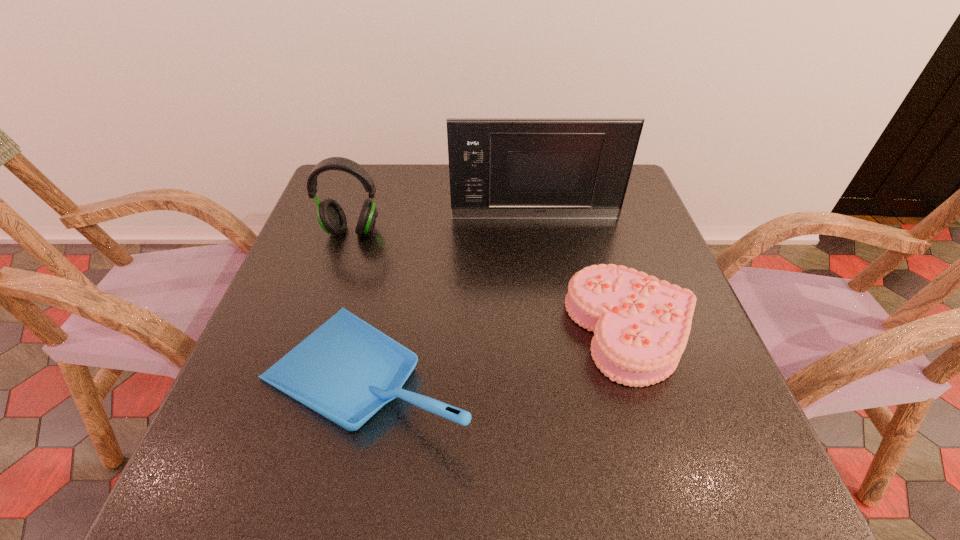
Locate an element on the screen. This screenshot has height=540, width=960. vacant region at the near left corner of the desktop is located at coordinates (228, 454).

Where is `vacant region at the far right corner of the desktop`? vacant region at the far right corner of the desktop is located at coordinates (637, 194).

In the image, there is a desktop. Where is `vacant space at the near right corner`? The width and height of the screenshot is (960, 540). vacant space at the near right corner is located at coordinates (746, 485).

At what (x,y) coordinates should I click in order to perform the action: click on vacant area that lies between the third shortest object and the microwave oven. Please return your answer as a coordinate pair (x, y). Image resolution: width=960 pixels, height=540 pixels. Looking at the image, I should click on (444, 225).

You are a GUI agent. You are given a task and a screenshot of the screen. Output one action in this format:
    pyautogui.click(x=<x>, y=<y>)
    Task: Click on the unoccupied position between the shortest object and the second shortest object
    Image resolution: width=960 pixels, height=540 pixels.
    Given the screenshot: What is the action you would take?
    pyautogui.click(x=500, y=353)

Image resolution: width=960 pixels, height=540 pixels. I want to click on unoccupied area between the shortest object and the second farthest object, so click(492, 280).

Where is `empty space that is in between the second shortest object and the second tallest object`? This screenshot has height=540, width=960. empty space that is in between the second shortest object and the second tallest object is located at coordinates (359, 303).

Where is `free area in between the third nearest object and the dustpan`? free area in between the third nearest object and the dustpan is located at coordinates (359, 303).

This screenshot has width=960, height=540. I want to click on free area in between the farthest object and the dustpan, so click(451, 296).

At what (x,y) coordinates should I click in order to perform the action: click on free space between the dustpan and the cake. Please return your answer as a coordinate pair (x, y). Looking at the image, I should click on (500, 353).